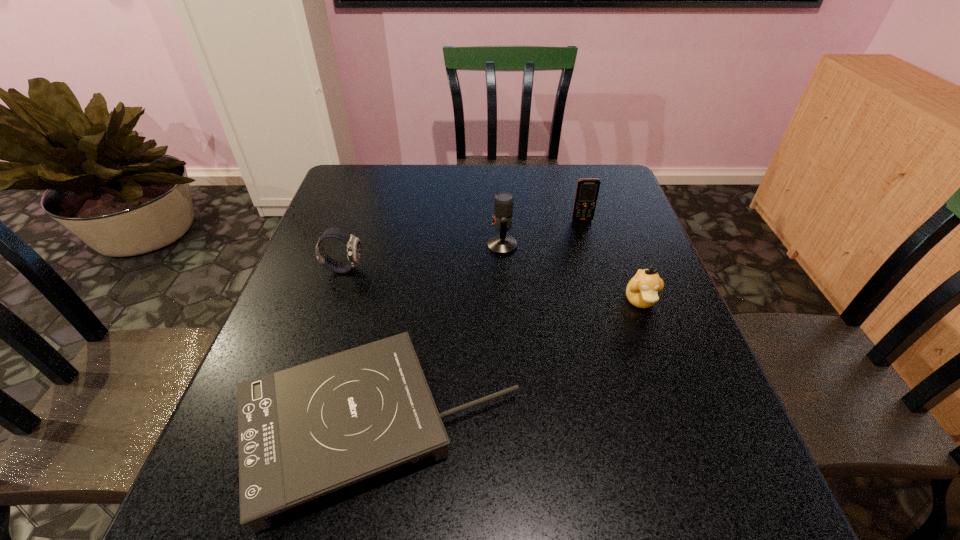
The image size is (960, 540). What are the coordinates of `microphone` in the screenshot? It's located at (502, 244).

Find the location of a particular element. The height and width of the screenshot is (540, 960). cellular telephone is located at coordinates (x=587, y=190).

What are the coordinates of `the farthest object` in the screenshot? It's located at (587, 190).

The height and width of the screenshot is (540, 960). I want to click on the third nearest object, so [354, 250].

You are a GUI agent. You are given a task and a screenshot of the screen. Output one action in this format:
    pyautogui.click(x=<x>, y=<y>)
    Task: Click on the second nearest object
    
    Given the screenshot: What is the action you would take?
    pyautogui.click(x=642, y=290)

This screenshot has width=960, height=540. I want to click on the rightmost object, so click(x=642, y=290).

Identify the location of the nearest object. (303, 432).

Identify the location of the shortest object. The width and height of the screenshot is (960, 540). [303, 432].

This screenshot has width=960, height=540. Identify the location of free space located 0.300m on the side of the microphone with the red ring. click(x=375, y=246).

The height and width of the screenshot is (540, 960). In order to click on vacant region located 0.160m on the side of the microphone with the red ring in this screenshot , I will do `click(427, 246)`.